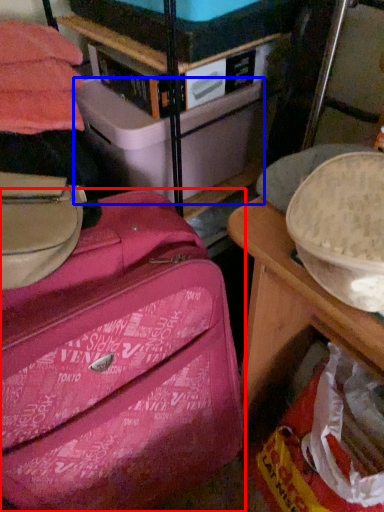
Question: Among these objects, which one is nearest to the camera, suitcase (highlighted by a red box) or storage box (highlighted by a blue box)?

Choices:
 (A) suitcase
 (B) storage box

Answer: (A)